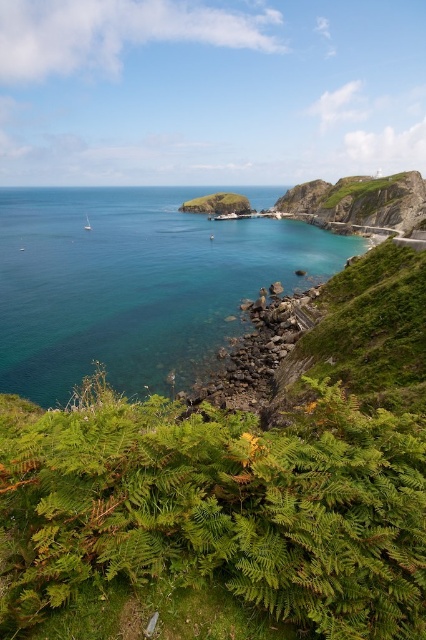
Can you confirm if green grassy hillside at upper right is thinner than white glossy boat at lower left?

In fact, green grassy hillside at upper right might be wider than white glossy boat at lower left.

I want to click on green grassy hillside at upper right, so click(x=360, y=200).

From the picture: Does green leafy ferns at lower center have a smaller size compared to clear blue water at center?

Indeed, green leafy ferns at lower center has a smaller size compared to clear blue water at center.

Is point (374, 474) less distant than point (328, 243)?

Yes.

Locate an element on the screen. The width and height of the screenshot is (426, 640). green leafy ferns at lower center is located at coordinates (218, 508).

Is clear blue water at center shorter than green grassy hill at center?

In fact, clear blue water at center may be taller than green grassy hill at center.

In the scene shown: Which is more to the right, clear blue water at center or green grassy hill at center?

From the viewer's perspective, green grassy hill at center appears more on the right side.

Identify the location of clear blue water at center. (137, 284).

Image resolution: width=426 pixels, height=640 pixels. I want to click on clear blue water at center, so click(137, 284).